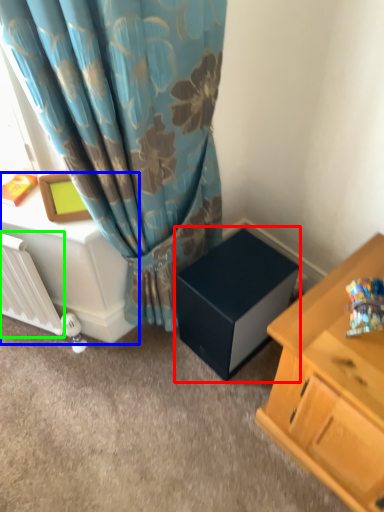
Question: Based on their relative distances, which object is farther from cardboard box (highlighted by a red box)? Choose from table (highlighted by a blue box) and radiator (highlighted by a green box).

Choices:
 (A) table
 (B) radiator

Answer: (B)